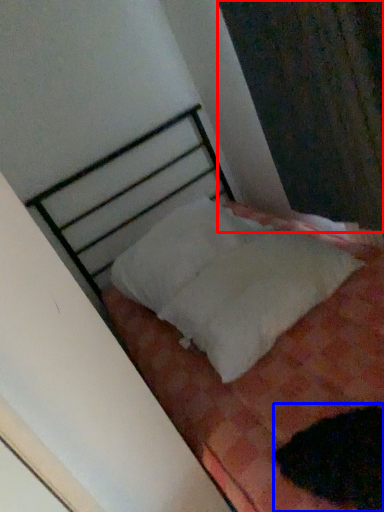
Question: Among these objects, which one is nearest to the camera, curtain (highlighted by a red box) or animal (highlighted by a blue box)?

Choices:
 (A) curtain
 (B) animal

Answer: (B)